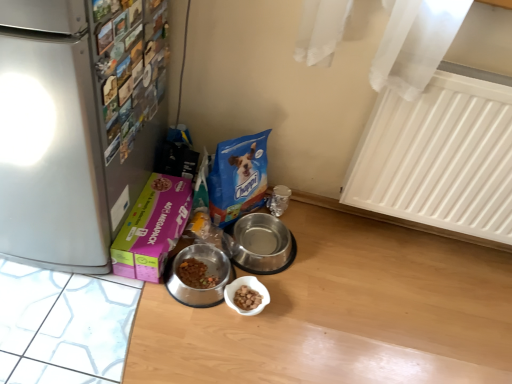
The height and width of the screenshot is (384, 512). I want to click on empty space that is ontop of pink cardboard box at lower left (from a real-world perspective), so click(x=161, y=206).